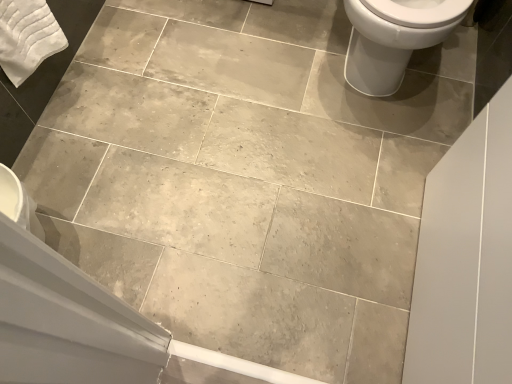
The height and width of the screenshot is (384, 512). Describe the element at coordinates (394, 38) in the screenshot. I see `white glossy toilet at upper right` at that location.

This screenshot has height=384, width=512. I want to click on white glossy toilet at upper right, so click(394, 38).

Locate an element on the screen. This screenshot has width=512, height=384. white cotton bath towel at upper left is located at coordinates (27, 37).

The width and height of the screenshot is (512, 384). What do you see at coordinates (27, 37) in the screenshot?
I see `white cotton bath towel at upper left` at bounding box center [27, 37].

Locate an element on the screen. Image resolution: width=512 pixels, height=384 pixels. white glossy toilet at upper right is located at coordinates (394, 38).

Considering the positions of objects white cotton bath towel at upper left and white glossy toilet at upper right in the image provided, who is more to the right, white cotton bath towel at upper left or white glossy toilet at upper right?

Positioned to the right is white glossy toilet at upper right.

Between white cotton bath towel at upper left and white glossy toilet at upper right, which one is positioned in front?

Positioned in front is white glossy toilet at upper right.

Considering the positions of points (3, 44) and (353, 0), is point (3, 44) farther from camera compared to point (353, 0)?

No, it is in front of (353, 0).

From the image's perspective, is white cotton bath towel at upper left above or below white glossy toilet at upper right?

white cotton bath towel at upper left is situated lower than white glossy toilet at upper right in the image.

From a real-world perspective, is white cotton bath towel at upper left under white glossy toilet at upper right?

No, from a real-world perspective, white cotton bath towel at upper left is not below white glossy toilet at upper right.

Which object is thinner, white cotton bath towel at upper left or white glossy toilet at upper right?

white cotton bath towel at upper left.

Who is shorter, white cotton bath towel at upper left or white glossy toilet at upper right?

Standing shorter between the two is white cotton bath towel at upper left.

Is white cotton bath towel at upper left bigger than white glossy toilet at upper right?

Incorrect, white cotton bath towel at upper left is not larger than white glossy toilet at upper right.

Is white cotton bath towel at upper left surrounding white glossy toilet at upper right?

No, white glossy toilet at upper right is not a part of white cotton bath towel at upper left.

Would you consider white cotton bath towel at upper left to be distant from white glossy toilet at upper right?

That's right, there is a large distance between white cotton bath towel at upper left and white glossy toilet at upper right.

Is white cotton bath towel at upper left looking in the opposite direction of white glossy toilet at upper right?

No, white glossy toilet at upper right is not at the back of white cotton bath towel at upper left.

How different are the orientations of white cotton bath towel at upper left and white glossy toilet at upper right in degrees?

90.3 degrees separate the facing orientations of white cotton bath towel at upper left and white glossy toilet at upper right.

You are a GUI agent. You are given a task and a screenshot of the screen. Output one action in this format:
    pyautogui.click(x=<x>, y=<y>)
    Task: Click on the bath towel above the white glossy toilet at upper right (from a real-world perspective)
    Image resolution: width=512 pixels, height=384 pixels.
    Given the screenshot: What is the action you would take?
    pyautogui.click(x=27, y=37)

Which is more to the left, white glossy toilet at upper right or white cotton bath towel at upper left?

From the viewer's perspective, white cotton bath towel at upper left appears more on the left side.

Which object is closer to the camera taking this photo, white glossy toilet at upper right or white cotton bath towel at upper left?

white glossy toilet at upper right is in front.

Between point (436, 9) and point (6, 6), which one is positioned in front?

The point (436, 9) is in front.

From the image's perspective, which object appears higher, white glossy toilet at upper right or white cotton bath towel at upper left?

From the image's view, white glossy toilet at upper right is above.

From a real-world perspective, is white glossy toilet at upper right physically above white cotton bath towel at upper left?

No, from a real-world perspective, white glossy toilet at upper right is not above white cotton bath towel at upper left.

Does white glossy toilet at upper right have a greater width compared to white cotton bath towel at upper left?

Yes.

Does white glossy toilet at upper right have a lesser height compared to white cotton bath towel at upper left?

Incorrect, the height of white glossy toilet at upper right does not fall short of that of white cotton bath towel at upper left.

Who is smaller, white glossy toilet at upper right or white cotton bath towel at upper left?

With smaller size is white cotton bath towel at upper left.

Is white glossy toilet at upper right positioned beyond the bounds of white cotton bath towel at upper left?

That's correct, white glossy toilet at upper right is outside of white cotton bath towel at upper left.

Is white glossy toilet at upper right positioned far away from white cotton bath towel at upper left?

That's right, there is a large distance between white glossy toilet at upper right and white cotton bath towel at upper left.

Is white glossy toilet at upper right oriented away from white cotton bath towel at upper left?

That's not correct — white glossy toilet at upper right is not looking away from white cotton bath towel at upper left.

Locate an element on the screen. bath towel on the left of the white glossy toilet at upper right is located at coordinates (27, 37).

Locate an element on the screen. This screenshot has width=512, height=384. bath towel lying below the white glossy toilet at upper right (from the image's perspective) is located at coordinates (27, 37).

Find the location of a particular element. The height and width of the screenshot is (384, 512). bath towel that is behind the white glossy toilet at upper right is located at coordinates pos(27,37).